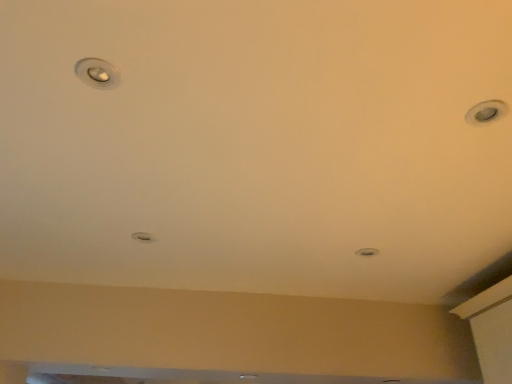
Identify the location of matte silver droplight at center, the 2th droplight when ordered from top to bottom. (143, 237).

How distant is matte silver droplight at upper left, which is the second droplight from bottom to top, from matte silver light at center?

3.67 feet.

Is matte silver droplight at upper left, which ranks as the 2th droplight in back-to-front order, to the left of matte silver light at center from the viewer's perspective?

Indeed, matte silver droplight at upper left, which ranks as the 2th droplight in back-to-front order, is positioned on the left side of matte silver light at center.

Which is correct: matte silver droplight at upper left, the 1th droplight from the right, is inside matte silver light at center, or outside of it?

matte silver droplight at upper left, the 1th droplight from the right, is not inside matte silver light at center, it's outside.

Does matte silver droplight at upper left, the 1th droplight from the right, lie behind matte silver light at center?

No, matte silver droplight at upper left, the 1th droplight from the right, is closer to the camera.

Can you confirm if matte silver light at center is taller than matte silver droplight at center, the 1th droplight in the left-to-right sequence?

Yes.

Is matte silver light at center smaller than matte silver droplight at center, which is the 2th droplight from front to back?

Correct, matte silver light at center occupies less space than matte silver droplight at center, which is the 2th droplight from front to back.

Is matte silver light at center wider or thinner than matte silver droplight at center, the 1th droplight in the left-to-right sequence?

Considering their sizes, matte silver light at center looks slimmer than matte silver droplight at center, the 1th droplight in the left-to-right sequence.

Which is more to the right, matte silver droplight at center, the 1th droplight from the bottom, or matte silver light at center?

matte silver light at center.

Which object is further away from the camera, matte silver droplight at center, the 2th droplight viewed from the right, or matte silver light at center?

matte silver light at center is further away from the camera.

Is matte silver droplight at center, the 2th droplight viewed from the right, positioned with its back to matte silver light at center?

That's not correct — matte silver droplight at center, the 2th droplight viewed from the right, is not looking away from matte silver light at center.

Can you confirm if matte silver droplight at center, the 1th droplight in the left-to-right sequence, is positioned to the right of matte silver droplight at upper left, marked as the 1th droplight in a top-to-bottom arrangement?

No, matte silver droplight at center, the 1th droplight in the left-to-right sequence, is not to the right of matte silver droplight at upper left, marked as the 1th droplight in a top-to-bottom arrangement.

Does point (141, 238) come farther from viewer compared to point (101, 76)?

That is True.

Is matte silver droplight at center, the 2th droplight when ordered from top to bottom, not near matte silver droplight at upper left, marked as the first droplight in a front-to-back arrangement?

No.

Would you say matte silver light at center is outside matte silver droplight at upper left, marked as the first droplight in a front-to-back arrangement?

matte silver light at center is positioned outside matte silver droplight at upper left, marked as the first droplight in a front-to-back arrangement.

Which of these two, matte silver light at center or matte silver droplight at upper left, the second droplight from the left, is wider?

Wider between the two is matte silver light at center.

Considering the relative positions of matte silver light at center and matte silver droplight at upper left, which ranks as the 2th droplight in back-to-front order, in the image provided, is matte silver light at center to the left or to the right of matte silver droplight at upper left, which ranks as the 2th droplight in back-to-front order,?

matte silver light at center is to the right of matte silver droplight at upper left, which ranks as the 2th droplight in back-to-front order.

Is matte silver droplight at upper left, the second droplight from the left, positioned far away from matte silver droplight at center, the 2th droplight when ordered from top to bottom?

No.

Is matte silver droplight at upper left, which is the second droplight from bottom to top, surrounding matte silver droplight at center, which is the 2th droplight from front to back?

Actually, matte silver droplight at center, which is the 2th droplight from front to back, is outside matte silver droplight at upper left, which is the second droplight from bottom to top.

In the image, is matte silver droplight at upper left, the 1th droplight from the right, on the left side or the right side of matte silver droplight at center, the 1th droplight in the left-to-right sequence?

matte silver droplight at upper left, the 1th droplight from the right, is positioned on matte silver droplight at center, the 1th droplight in the left-to-right sequence,'s right side.

From the image's perspective, would you say matte silver droplight at upper left, which ranks as the 2th droplight in back-to-front order, is shown under matte silver droplight at center, acting as the first droplight starting from the back?

Incorrect, from the image's perspective, matte silver droplight at upper left, which ranks as the 2th droplight in back-to-front order, is higher than matte silver droplight at center, acting as the first droplight starting from the back.

Where is `droplight that is the 2nd object located above the matte silver light at center (from the image's perspective)`? The image size is (512, 384). droplight that is the 2nd object located above the matte silver light at center (from the image's perspective) is located at coordinates (97, 73).

At what (x,y) coordinates should I click in order to perform the action: click on the 2nd droplight to the left of the matte silver light at center, counting from the anchor's position. Please return your answer as a coordinate pair (x, y). Looking at the image, I should click on [143, 237].

Considering their positions, is matte silver light at center positioned closer to matte silver droplight at upper left, marked as the first droplight in a front-to-back arrangement, than matte silver droplight at center, which is the 2th droplight from front to back?

matte silver droplight at center, which is the 2th droplight from front to back, is closer to matte silver droplight at upper left, marked as the first droplight in a front-to-back arrangement.

Which object lies further to the anchor point matte silver droplight at center, the 2th droplight viewed from the right, matte silver droplight at upper left, the 1th droplight from the right, or matte silver light at center?

Among the two, matte silver light at center is located further to matte silver droplight at center, the 2th droplight viewed from the right.

When comparing their distances from matte silver light at center, does matte silver droplight at center, the 1th droplight from the bottom, or matte silver droplight at upper left, which is the second droplight from bottom to top, seem further?

matte silver droplight at upper left, which is the second droplight from bottom to top, is further to matte silver light at center.

When comparing their distances from matte silver droplight at upper left, the 1th droplight from the right, does matte silver droplight at center, the 2th droplight viewed from the right, or matte silver light at center seem further?

matte silver light at center is positioned further to the anchor matte silver droplight at upper left, the 1th droplight from the right.

Looking at the image, which one is located further to matte silver light at center, matte silver droplight at upper left, marked as the 1th droplight in a top-to-bottom arrangement, or matte silver droplight at center, the 2th droplight viewed from the right?

Among the two, matte silver droplight at upper left, marked as the 1th droplight in a top-to-bottom arrangement, is located further to matte silver light at center.

When comparing their distances from matte silver droplight at center, the 2th droplight when ordered from top to bottom, does matte silver light at center or matte silver droplight at upper left, marked as the 1th droplight in a top-to-bottom arrangement, seem further?

The object further to matte silver droplight at center, the 2th droplight when ordered from top to bottom, is matte silver light at center.

Identify the location of droplight between matte silver droplight at center, the 2th droplight when ordered from top to bottom, and matte silver light at center, in the horizontal direction. Image resolution: width=512 pixels, height=384 pixels. (97, 73).